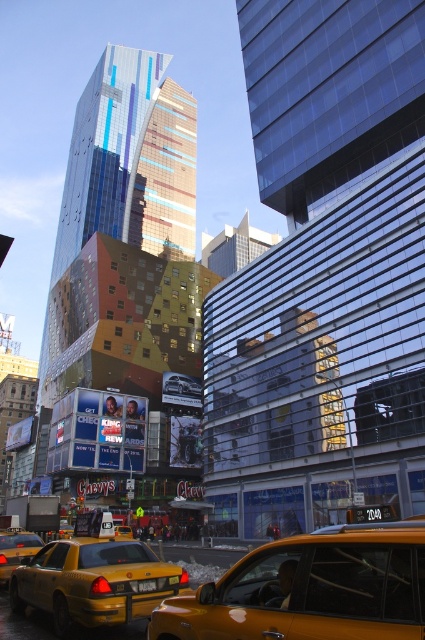
You are a city planner analyzing traffic flow. You observe the yellow rubber taxi at center and the yellow matte taxi cab at lower left in the scene. Which taxi is closer to the ground?

The yellow rubber taxi at center is shorter than the yellow matte taxi cab at lower left, so it is closer to the ground.

You are a pedestrian standing at the crosswalk and see the metallic silver car at center and the yellow matte taxi cab at lower left. Which vehicle is closer to the right side of the road?

The metallic silver car at center is to the right of the yellow matte taxi cab at lower left, so the metallic silver car at center is closer to the right side of the road.